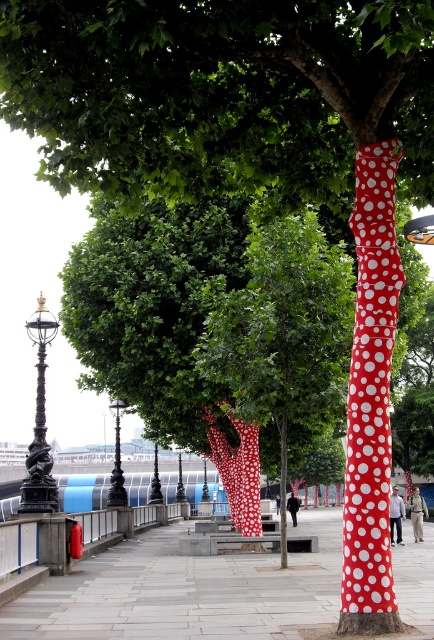
Question: Estimate the real-world distances between objects in this image. Which object is closer to the black metal pole at left?

Choices:
 (A) smooth concrete pavement at center
 (B) red dotted fabric at center
 (C) red dotted pole at right
 (D) black polished metal pole at center

Answer: (A)

Question: Which point is closer to the camera?

Choices:
 (A) red dotted pole at right
 (B) red dotted fabric at center

Answer: (A)

Question: Is red dotted pole at right closer to the viewer compared to black metal pole at left?

Choices:
 (A) yes
 (B) no

Answer: (A)

Question: Which point is closer to the camera?

Choices:
 (A) red dotted fabric at center
 (B) red dotted pole at right
 (C) black polished metal pole at center

Answer: (B)

Question: Can you confirm if red dotted pole at right is wider than black polished metal pole at center?

Choices:
 (A) no
 (B) yes

Answer: (A)

Question: Can you confirm if red dotted fabric at center is positioned to the left of black metal pole at left?

Choices:
 (A) yes
 (B) no

Answer: (B)